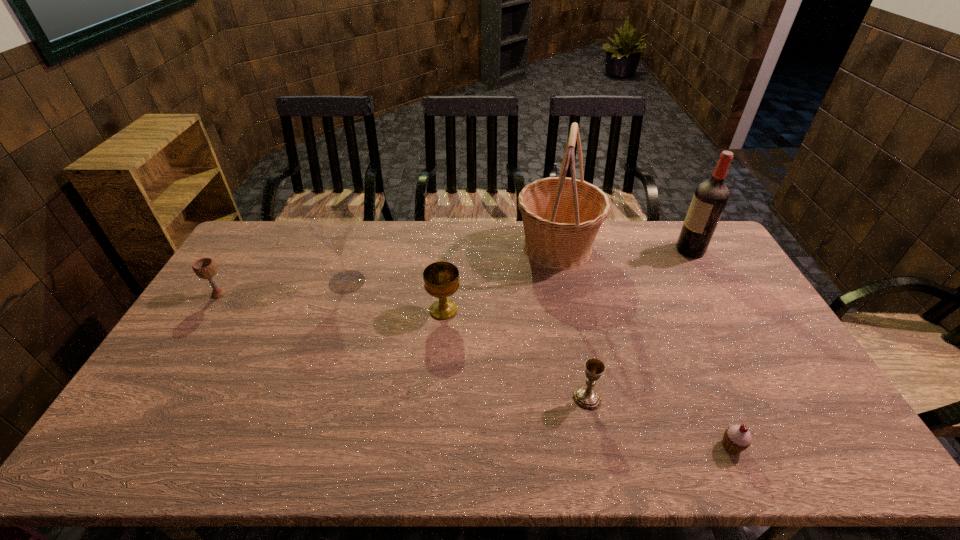
Locate an element on the screen. The width and height of the screenshot is (960, 540). basket is located at coordinates (561, 216).

The width and height of the screenshot is (960, 540). In order to click on the sixth shortest object in this screenshot , I will do `click(710, 197)`.

Locate an element on the screen. liquor is located at coordinates (710, 197).

Image resolution: width=960 pixels, height=540 pixels. I want to click on the sixth object from right to left, so click(x=333, y=229).

You are a GUI agent. You are given a task and a screenshot of the screen. Output one action in this format:
    pyautogui.click(x=<x>, y=<y>)
    Task: Click on the fifth shortest object
    The image size is (960, 540).
    Given the screenshot: What is the action you would take?
    pyautogui.click(x=333, y=229)

Locate an element on the screen. the fourth tallest object is located at coordinates (441, 279).

Find the location of `the tallest chalice`. the tallest chalice is located at coordinates (441, 279).

The height and width of the screenshot is (540, 960). What are the coordinates of `the leftmost object` in the screenshot? It's located at (205, 268).

Locate an element on the screen. The width and height of the screenshot is (960, 540). the nearest chalice is located at coordinates (586, 396).

Locate an element on the screen. Image resolution: width=960 pixels, height=540 pixels. the rightmost chalice is located at coordinates (586, 396).